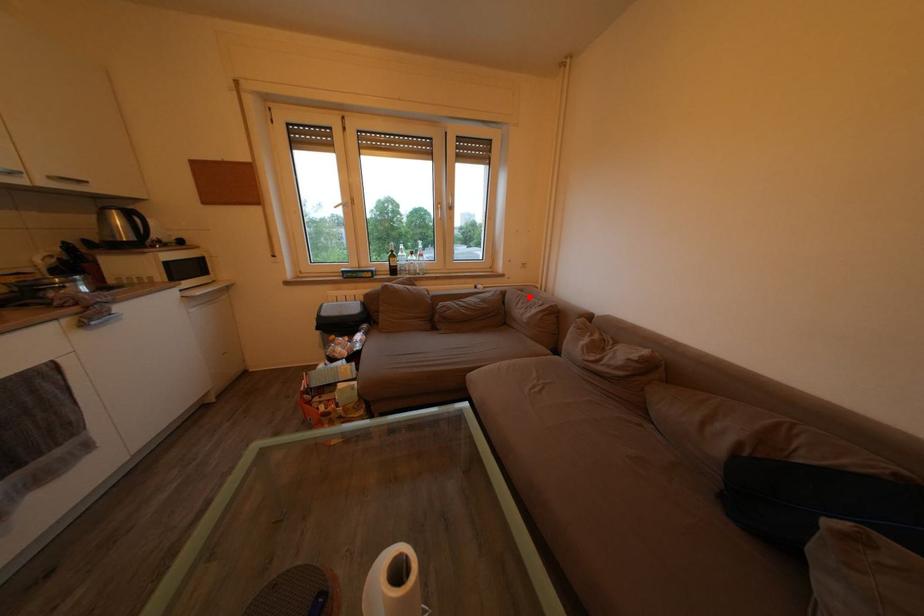
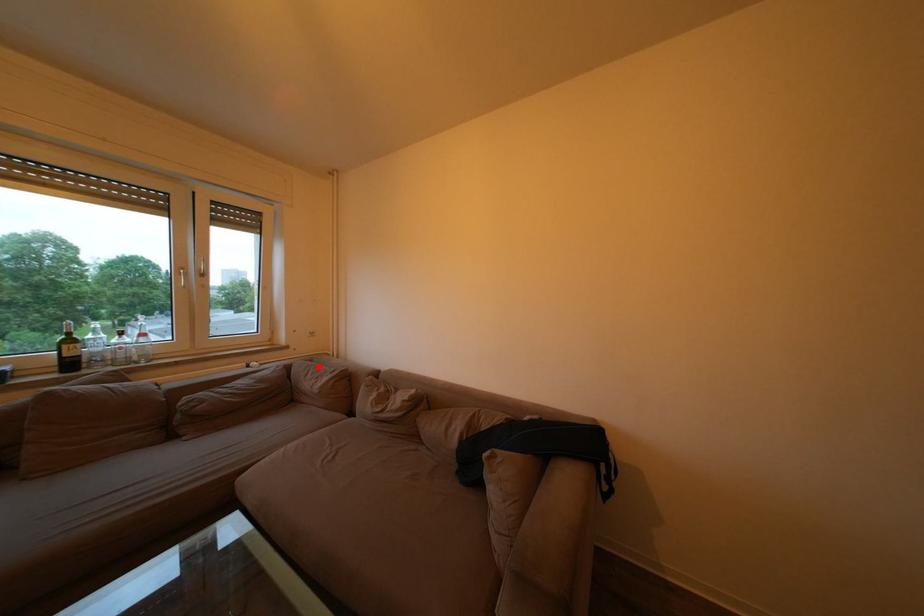
I am providing you with two images of the same scene from different viewpoints. A red point is marked on the first image and another point is marked on the second image. Is the red point in image1 aligned with the point shown in image2?

Yes